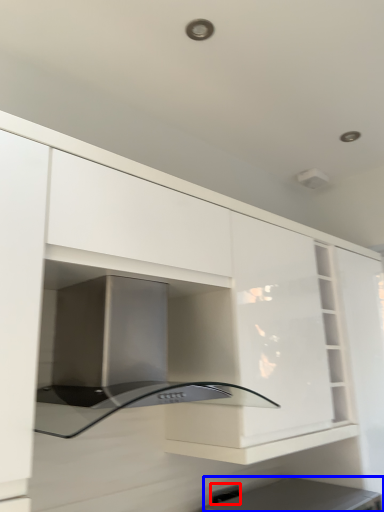
Question: Which object is closer to the camera taking this photo, electric outlet (highlighted by a red box) or appliance (highlighted by a blue box)?

Choices:
 (A) electric outlet
 (B) appliance

Answer: (B)